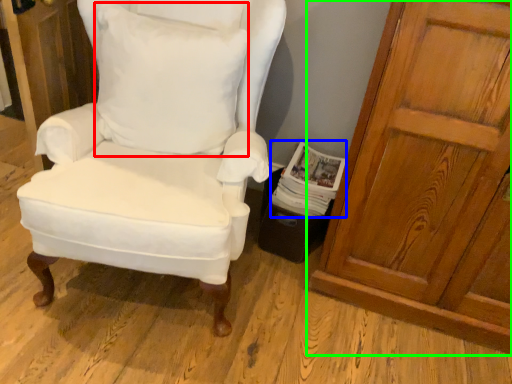
Question: Which object is the farthest from pillow (highlighted by a red box)? Choose among these: magazine (highlighted by a blue box) or door (highlighted by a green box).

Choices:
 (A) magazine
 (B) door

Answer: (B)